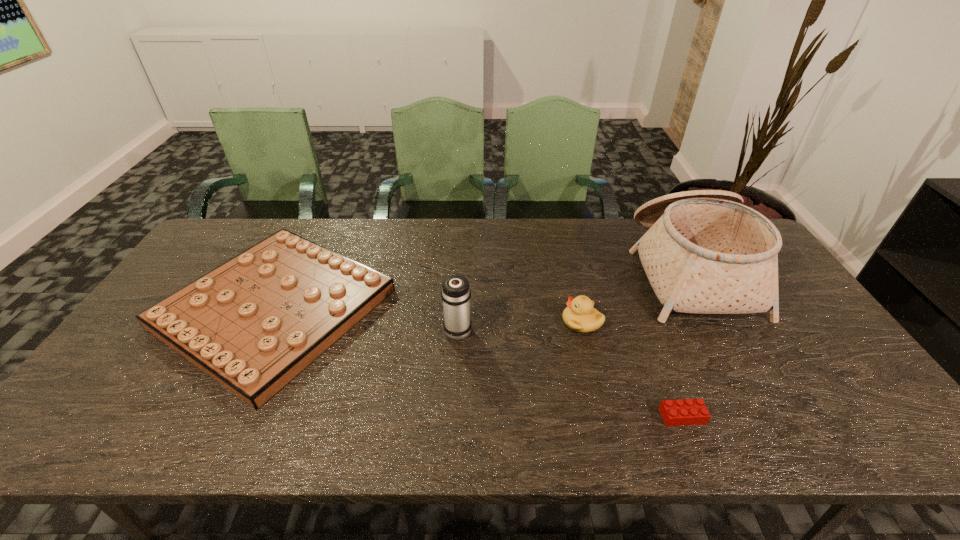
Identify the location of free region located 0.250m with the lid open on the basket. The height and width of the screenshot is (540, 960). (556, 270).

Where is `vacant region located 0.190m on the side with the handle of the thermos bottle`? The width and height of the screenshot is (960, 540). vacant region located 0.190m on the side with the handle of the thermos bottle is located at coordinates (461, 273).

Where is `blank area located 0.130m on the side with the handle of the thermos bottle`? blank area located 0.130m on the side with the handle of the thermos bottle is located at coordinates (460, 286).

This screenshot has width=960, height=540. I want to click on vacant area located 0.280m on the side with the handle of the thermos bottle, so click(462, 255).

Image resolution: width=960 pixels, height=540 pixels. What are the coordinates of `free region located 0.130m on the beak of the duckling` in the screenshot? It's located at (516, 322).

Find the location of a particular element. This screenshot has height=540, width=960. free space located 0.250m on the beak of the duckling is located at coordinates (472, 322).

Where is `free spot located on the beak of the duckling`? This screenshot has height=540, width=960. free spot located on the beak of the duckling is located at coordinates (501, 322).

Locate an element on the screen. The image size is (960, 540). vacant space located on the right of the leftmost object is located at coordinates (419, 307).

The image size is (960, 540). In order to click on vacant region located on the right of the shortest object in this screenshot , I will do `click(765, 416)`.

You are a GUI agent. You are given a task and a screenshot of the screen. Output one action in this format:
    pyautogui.click(x=<x>, y=<y>)
    Task: Click on the basket located at the far edge
    The width and height of the screenshot is (960, 540).
    Given the screenshot: What is the action you would take?
    pyautogui.click(x=705, y=252)